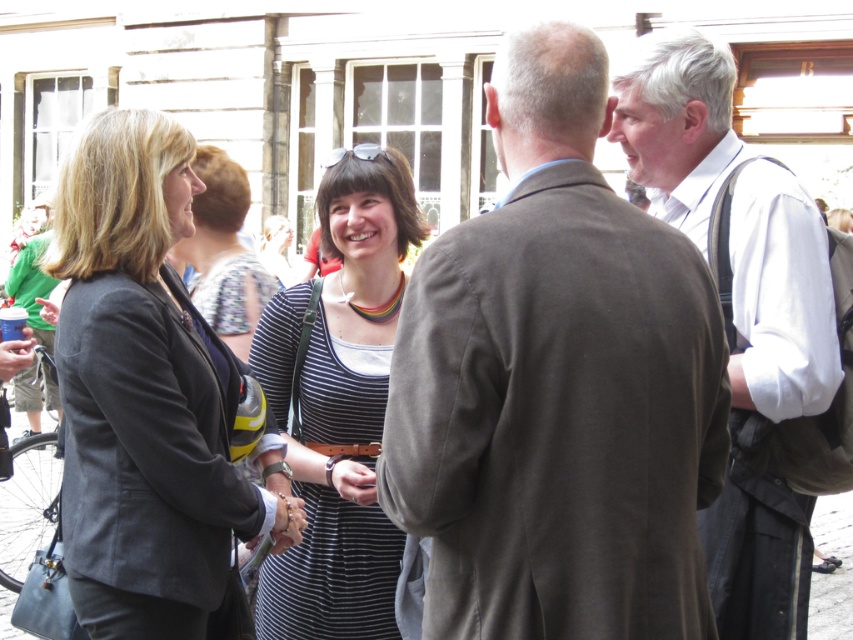
You are a photographer setting up for an event. You need to adjust the camera focus so that both the gray wool suit at center and the white shirt at upper right are in focus. Considering their heights, which object should you focus on first to ensure both are sharp?

The gray wool suit at center has a lesser height compared to white shirt at upper right. To ensure both are in focus, you should focus on the white shirt at upper right first, as it is taller and adjusting focus starting from the taller object can help capture the shorter one within the depth of field.

You are a photographer trying to capture a candid shot of the striped fabric dress at center without including the white shirt at upper right in the frame. Based on their positions, is this possible?

The white shirt at upper right is positioned over the striped fabric dress at center, so it would block the view. Therefore, capturing the striped fabric dress at center without including the white shirt at upper right in the frame is not possible.

You are a photographer trying to capture a candid shot of the gray wool suit at center and the white shirt at upper right. Since you want both subjects in the frame, can you tell me which one is positioned lower in the image?

The gray wool suit at center is located below the white shirt at upper right, so the gray wool suit at center is positioned lower in the image.